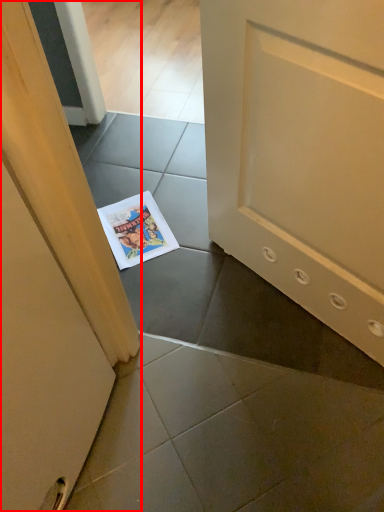
Question: From the image's perspective, what is the correct spatial relationship of door (annotated by the red box) in relation to comic book?

Choices:
 (A) above
 (B) below

Answer: (B)